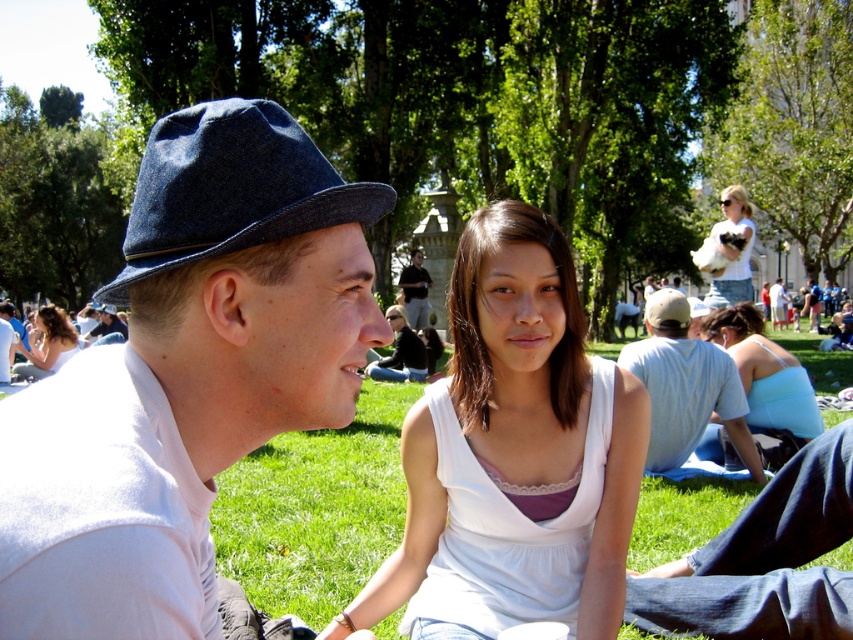
Question: Does light blue denim jeans at center have a lesser width compared to matte black hat at upper left?

Choices:
 (A) no
 (B) yes

Answer: (B)

Question: Which point is closer to the camera?

Choices:
 (A) white cotton shirt at center
 (B) light blue fabric top at lower right
 (C) denim fedora at left

Answer: (C)

Question: Is denim fedora at left bigger than light blue fabric top at lower right?

Choices:
 (A) yes
 (B) no

Answer: (A)

Question: Estimate the real-world distances between objects in this image. Which object is closer to the matte black nose at center?

Choices:
 (A) white cotton shirt at upper right
 (B) blonde hair at lower left

Answer: (B)

Question: Which object is positioned farthest from the light blue fabric top at lower right?

Choices:
 (A) light blue denim jeans at center
 (B) white matte hat at center

Answer: (B)

Question: Is light blue denim jeans at center wider than white cotton shirt at upper right?

Choices:
 (A) yes
 (B) no

Answer: (B)